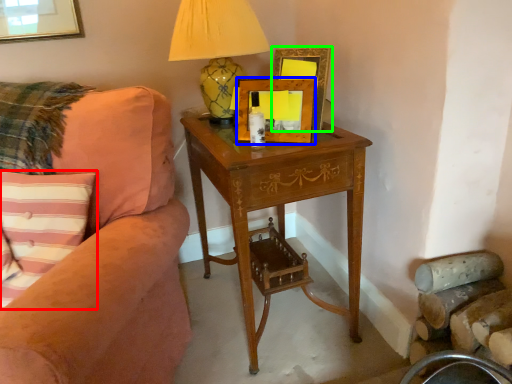
Question: Which object is the farthest from pillow (highlighted by a red box)? Choose among these: picture frame (highlighted by a blue box) or picture frame (highlighted by a green box).

Choices:
 (A) picture frame
 (B) picture frame

Answer: (B)